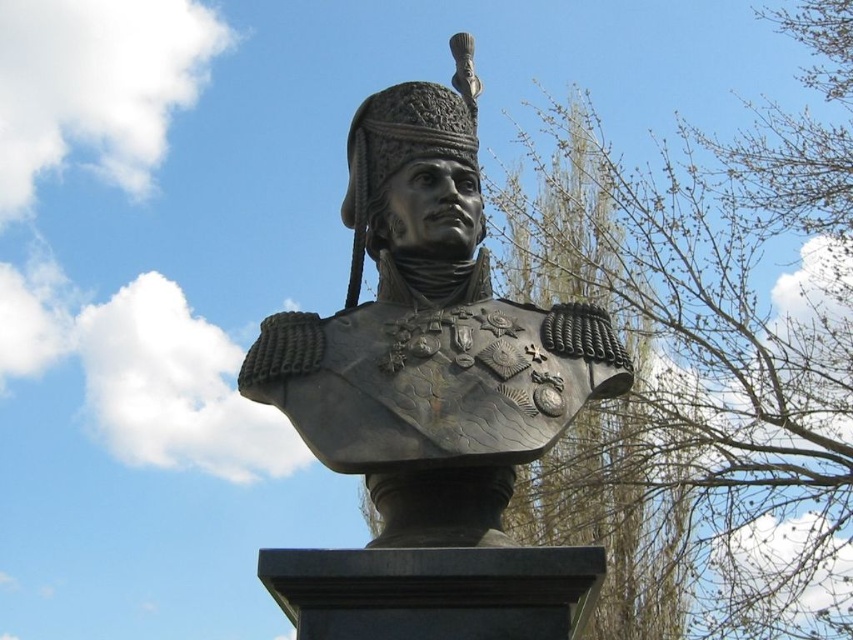
You are a sculptor who wants to place a protective cover over the shiny bronze bust at center and the shiny bronze helmet at center. Since the cover can only be placed on the object that is closer to the viewer, which one should you choose?

The shiny bronze bust at center is in front of the shiny bronze helmet at center, so you should place the protective cover on the shiny bronze bust at center since it is closer to the viewer.

You are an art student analyzing the composition of a sculpture. You observe the bare branches at upper center and the shiny bronze bust at center. Which object occupies a larger portion of the image?

The bare branches at upper center occupies a larger portion of the image than the shiny bronze bust at center according to the description.

You are a sculptor examining the statue of the historical figure. You notice the bare branches at upper center and the shiny bronze helmet at center. Which object is taller in the image?

The bare branches at upper center is taller than the shiny bronze helmet at center.